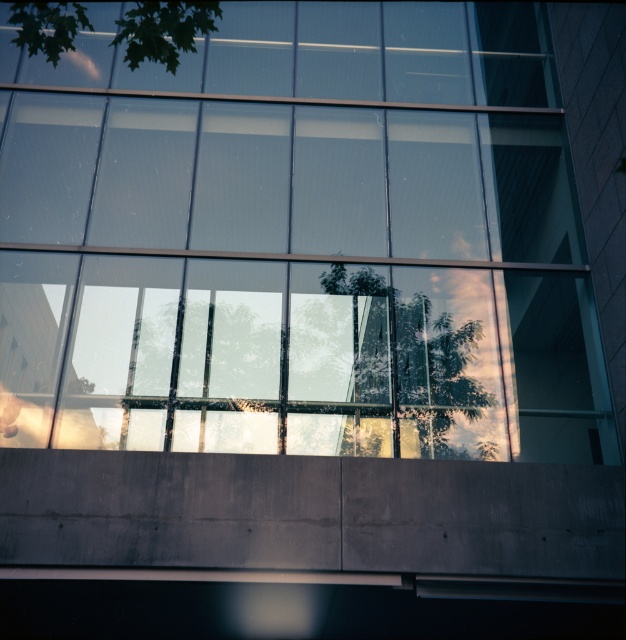
Question: In this image, where is transparent glass window at center located relative to green leafy tree at upper left?

Choices:
 (A) left
 (B) right

Answer: (B)

Question: Which object appears closest to the camera in this image?

Choices:
 (A) green leafy tree at upper left
 (B) transparent glass window at center

Answer: (A)

Question: In this image, where is transparent glass window at center located relative to green leafy tree at upper left?

Choices:
 (A) above
 (B) below

Answer: (B)

Question: Where is transparent glass window at center located in relation to green leafy tree at upper left in the image?

Choices:
 (A) above
 (B) below

Answer: (B)